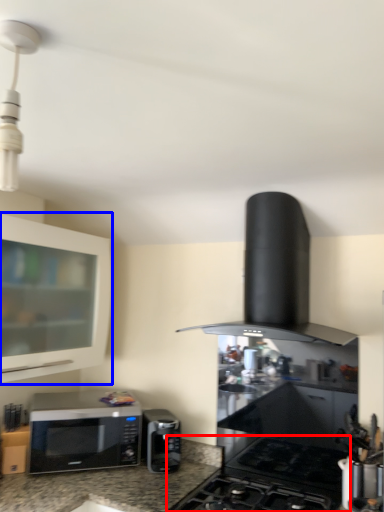
Question: Among these objects, which one is nearest to the camera, gas stove (highlighted by a red box) or cabinetry (highlighted by a blue box)?

Choices:
 (A) gas stove
 (B) cabinetry

Answer: (A)